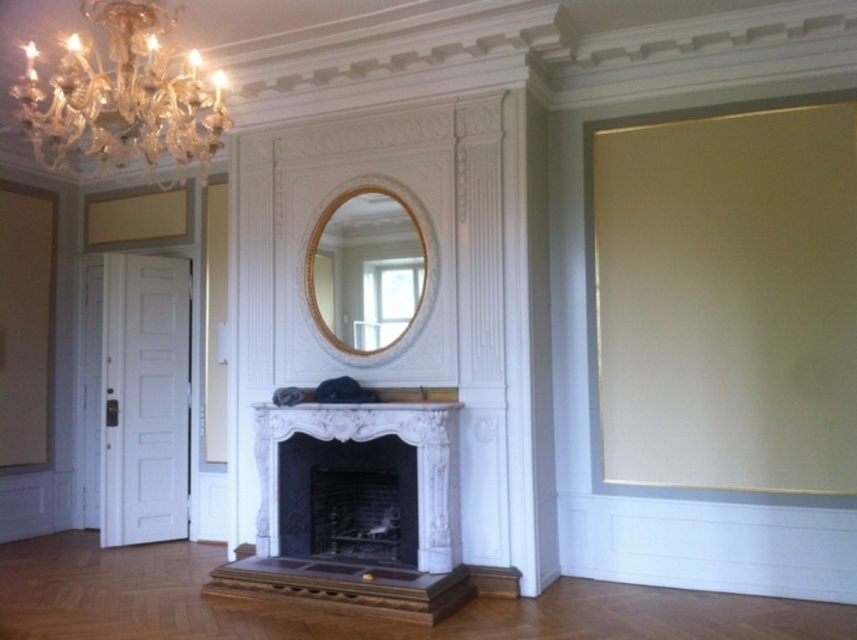
You are an interior designer planning to place a large sofa in front of the white marble fireplace at center. Considering the space, will the sofa fit if the crystal glass chandelier at upper left is hanging directly above where the sofa will be placed?

The white marble fireplace at center is wider than the crystal glass chandelier at upper left, so the sofa should fit as the fireplace provides sufficient width for placement, and the chandelier is narrower above the area.

You are a guest standing in the living room and want to locate the crystal glass chandelier at upper left and the dark gray stone fireplace at center. From your perspective, which object is positioned to the left?

The crystal glass chandelier at upper left is positioned to the left of the dark gray stone fireplace at center, so the crystal glass chandelier at upper left is on the left side.